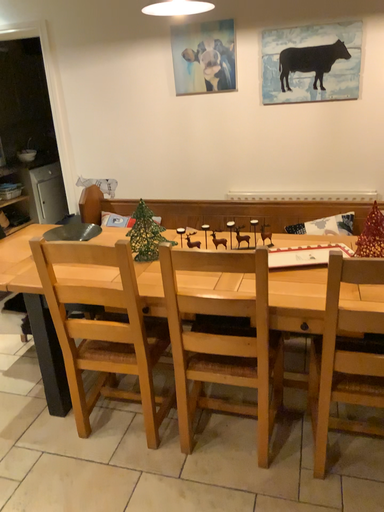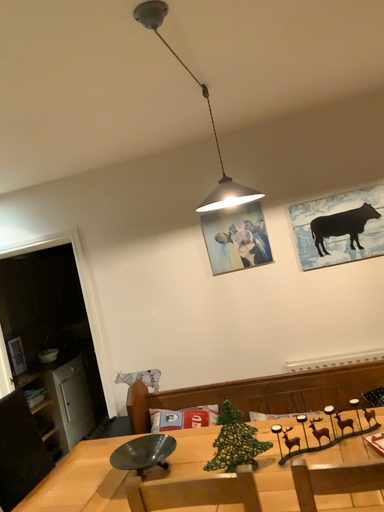
Question: Which way did the camera rotate in the video?

Choices:
 (A) rotated downward
 (B) rotated upward

Answer: (B)